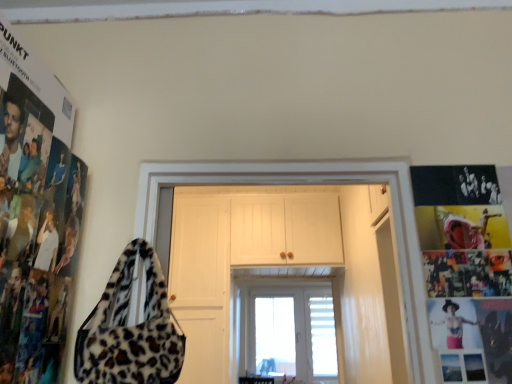
Question: Can you confirm if white wooden door at center is shorter than leather-like red pants at lower right?

Choices:
 (A) no
 (B) yes

Answer: (A)

Question: From a real-world perspective, is white wooden door at center beneath leather-like red pants at lower right?

Choices:
 (A) yes
 (B) no

Answer: (B)

Question: Can you confirm if white wooden door at center is wider than leather-like red pants at lower right?

Choices:
 (A) no
 (B) yes

Answer: (B)

Question: From a real-world perspective, is white wooden door at center physically above leather-like red pants at lower right?

Choices:
 (A) no
 (B) yes

Answer: (B)

Question: From the image's perspective, is white wooden door at center over leather-like red pants at lower right?

Choices:
 (A) no
 (B) yes

Answer: (A)

Question: Does point (130, 317) appear closer or farther from the camera than point (321, 319)?

Choices:
 (A) farther
 (B) closer

Answer: (B)

Question: From the image's perspective, is white wooden door at center above or below transparent glass door at center?

Choices:
 (A) above
 (B) below

Answer: (A)

Question: Visually, is white wooden door at center positioned to the left or to the right of transparent glass door at center?

Choices:
 (A) left
 (B) right

Answer: (A)

Question: Is white wooden door at center situated inside transparent glass door at center or outside?

Choices:
 (A) outside
 (B) inside

Answer: (A)

Question: Considering the relative positions of white wooden door at center and leopard print fabric shoulder bag at left in the image provided, is white wooden door at center to the left or to the right of leopard print fabric shoulder bag at left?

Choices:
 (A) left
 (B) right

Answer: (B)

Question: Considering the positions of white wooden door at center and leopard print fabric shoulder bag at left in the image, is white wooden door at center wider or thinner than leopard print fabric shoulder bag at left?

Choices:
 (A) wide
 (B) thin

Answer: (A)

Question: Considering the positions of point (400, 221) and point (166, 350), is point (400, 221) closer or farther from the camera than point (166, 350)?

Choices:
 (A) farther
 (B) closer

Answer: (A)

Question: From the image's perspective, relative to leopard print fabric shoulder bag at left, is white wooden door at center above or below?

Choices:
 (A) below
 (B) above

Answer: (A)

Question: Considering the positions of white wooden door at center and black matte poster at right in the image, is white wooden door at center wider or thinner than black matte poster at right?

Choices:
 (A) thin
 (B) wide

Answer: (B)

Question: Would you say white wooden door at center is inside or outside black matte poster at right?

Choices:
 (A) inside
 (B) outside

Answer: (B)